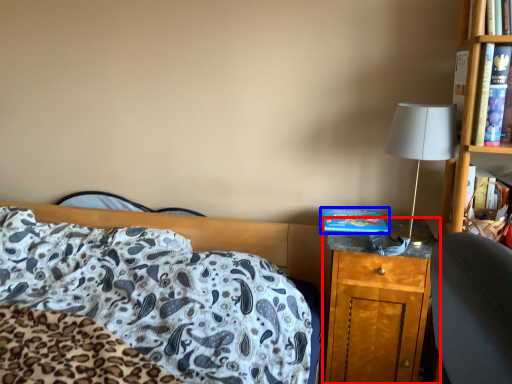
Question: Which object appears closest to the camera in this image, nightstand (highlighted by a red box) or hardback book (highlighted by a blue box)?

Choices:
 (A) nightstand
 (B) hardback book

Answer: (A)